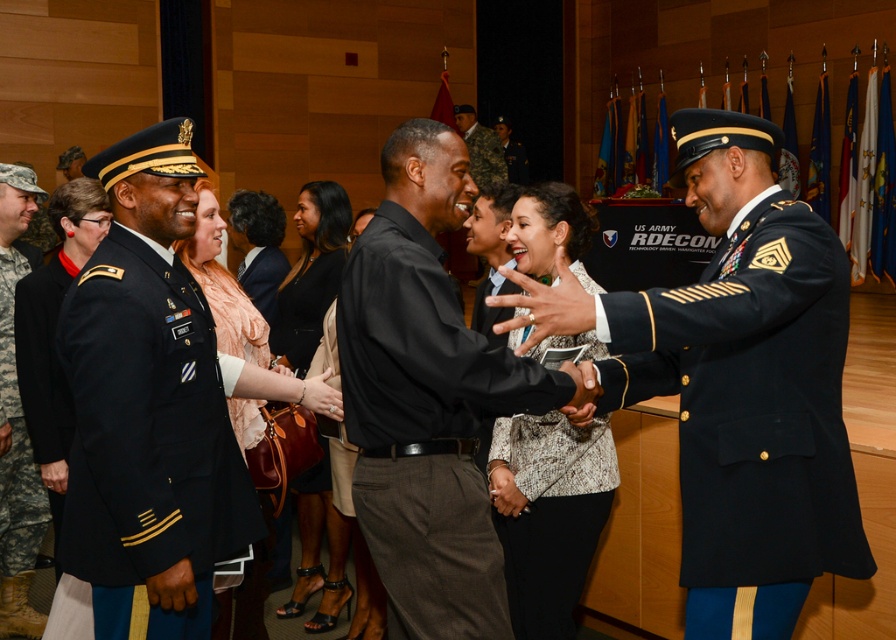
Question: Which object is farther from the camera taking this photo?

Choices:
 (A) patterned fabric blouse at center
 (B) matte peach dress at center
 (C) dark blue wool military jacket at right

Answer: (A)

Question: Can you confirm if dark blue wool military jacket at right is wider than black smooth shirt at center?

Choices:
 (A) yes
 (B) no

Answer: (A)

Question: Does navy blue wool military uniform at left appear under camouflage uniform at center?

Choices:
 (A) no
 (B) yes

Answer: (B)

Question: Considering the real-world distances, which object is closest to the black smooth shirt at center?

Choices:
 (A) camouflage uniform at center
 (B) dark blue wool military jacket at right
 (C) dark blue fabric jacket at center

Answer: (B)

Question: Does satin beige dress at center appear under dark blue fabric jacket at center?

Choices:
 (A) no
 (B) yes

Answer: (A)

Question: Considering the real-world distances, which object is closest to the matte peach dress at center?

Choices:
 (A) black smooth shirt at center
 (B) camouflage uniform at center
 (C) dark blue wool military jacket at right
 (D) matte black uniform at center

Answer: (A)